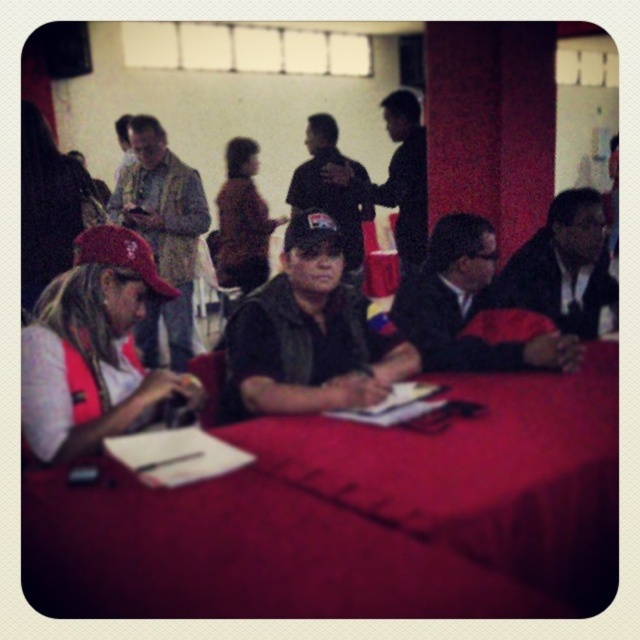
You are a stagehand preparing to move a 24 inch wide box onto the stage. You see the brown leather jacket at center and the dark blue fabric cap at center. Is there enough space between them to place the box?

The distance between the brown leather jacket at center and the dark blue fabric cap at center is 23.83 inches, which is slightly less than the 24 inch width of the box. Therefore, there isn not enough space to place the box between them.